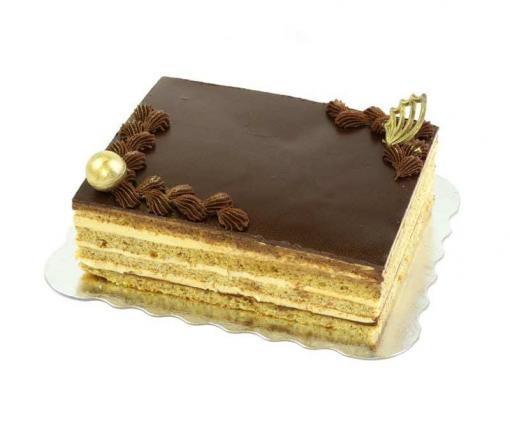
What are the coordinates of `decoration` in the screenshot? It's located at (101, 166).